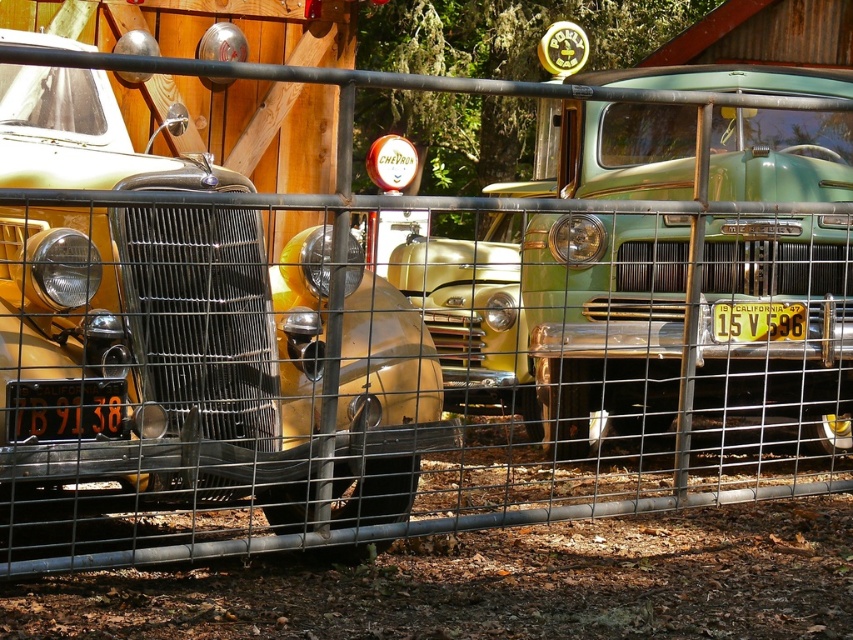
You are standing in front of two vintage cars behind a metal fence. You see a point marked at coordinates (218, 364). Which car does this point correspond to?

The point at coordinates (218, 364) corresponds to the matte yellow car at left.

You are a parking attendant who needs to fit a new car into the space between the matte yellow car at left and the yellow metal license plate at center. Based on their sizes, can the new car be parked there without overlapping either object?

The matte yellow car at left might be wider than the yellow metal license plate at center, so there is uncertainty about the available space. It is safer to measure the distance between them before attempting to park the new car.

You are a photographer trying to capture both license plates clearly in a single shot. Given that the black metal license plate at lower left is narrower than the yellow metal license plate at center, which license plate will require you to adjust your camera focus more to ensure clarity?

The black metal license plate at lower left requires more focus adjustment because it is narrower than the yellow metal license plate at center, making it potentially harder to capture clearly in the same frame.